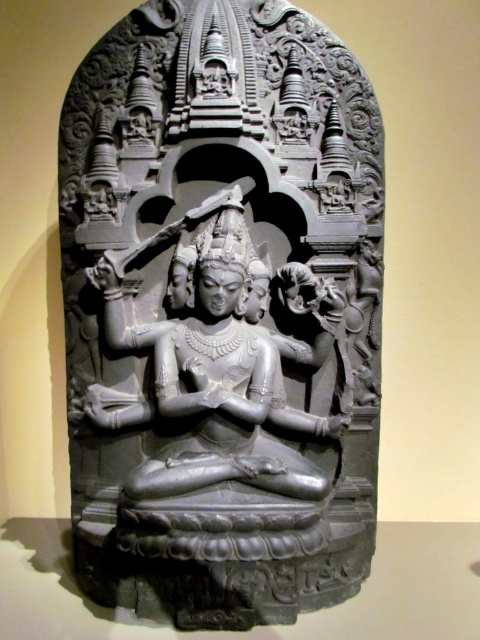
You are an art conservator standing 10 feet away from a black stone statue at center. Can you safely approach within 5 feet to examine it without violating the museum exhibit guidelines that require a minimum distance of 5 feet from the artwork?

The black stone statue at center is 7.78 feet away from you. Since the minimum required distance is 5 feet, you can approach closer to examine it as long as you maintain at least 5 feet distance. Subtracting 5 feet from your current 10 feet distance leaves 5 feet remaining, so you can move 2.22 feet closer while staying within guidelines.

You are an art conservator examining the stone relief sculpture. You need to determine if the black stone statue at center can be moved to the space currently occupied by the gray stone statue at center. Based on their widths, is this feasible?

The black stone statue at center might be wider than gray stone statue at center, so it may not fit in the space intended for the gray stone statue at center. Further measurements are needed to confirm.